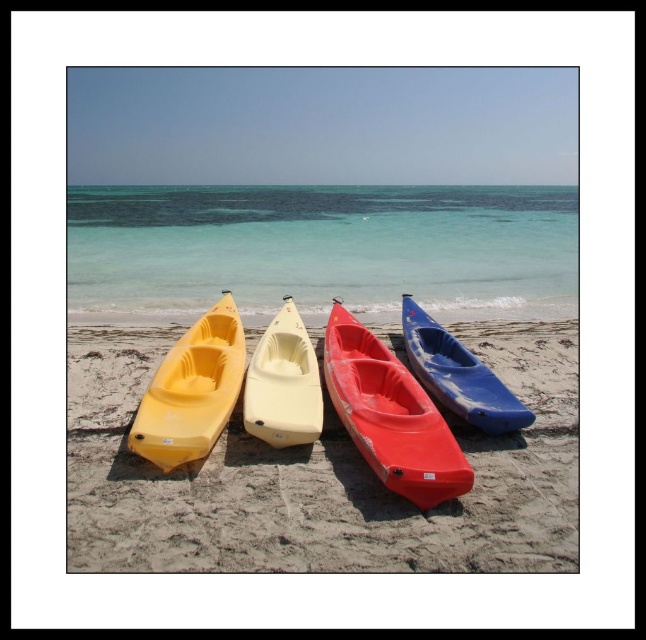
In the scene shown: Who is lower down, matte yellow canoe at left or matte yellow canoe at center?

Positioned lower is matte yellow canoe at left.

Who is shorter, matte yellow canoe at left or matte yellow canoe at center?

matte yellow canoe at center is shorter.

Is point (191, 346) behind point (317, 381)?

Yes, it is.

Locate an element on the screen. matte yellow canoe at left is located at coordinates 191,390.

Locate an element on the screen. Image resolution: width=646 pixels, height=640 pixels. smooth sand at center is located at coordinates (318, 476).

The height and width of the screenshot is (640, 646). What do you see at coordinates (318, 476) in the screenshot?
I see `smooth sand at center` at bounding box center [318, 476].

Between point (530, 545) and point (401, 408), which one is positioned in front?

Point (530, 545) is more forward.

At what (x,y) coordinates should I click in order to perform the action: click on smooth sand at center. Please return your answer as a coordinate pair (x, y). Image resolution: width=646 pixels, height=640 pixels. Looking at the image, I should click on (318, 476).

Can you confirm if matte red canoe at center is shorter than blue glossy canoe at center?

No, matte red canoe at center is not shorter than blue glossy canoe at center.

Does point (446, 426) come closer to viewer compared to point (470, 413)?

That is True.

Measure the distance between matte red canoe at center and camera.

They are 4.03 meters apart.

Where is `matte red canoe at center`? Image resolution: width=646 pixels, height=640 pixels. matte red canoe at center is located at coordinates (390, 416).